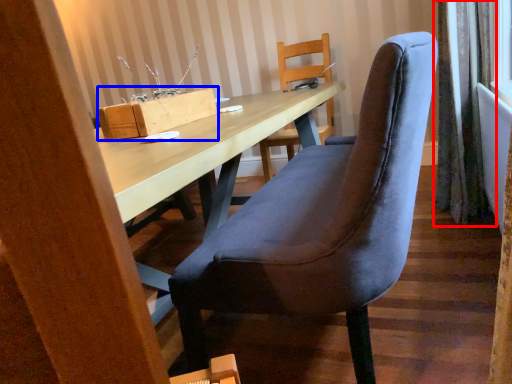
Question: Which object is further to the camera taking this photo, curtain (highlighted by a red box) or cardboard box (highlighted by a blue box)?

Choices:
 (A) curtain
 (B) cardboard box

Answer: (A)